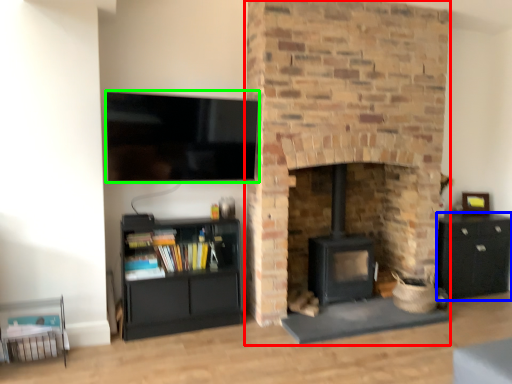
Question: Which is nearer to the fireplace (highlighted by a red box)? cabinetry (highlighted by a blue box) or television (highlighted by a green box).

Choices:
 (A) cabinetry
 (B) television

Answer: (B)